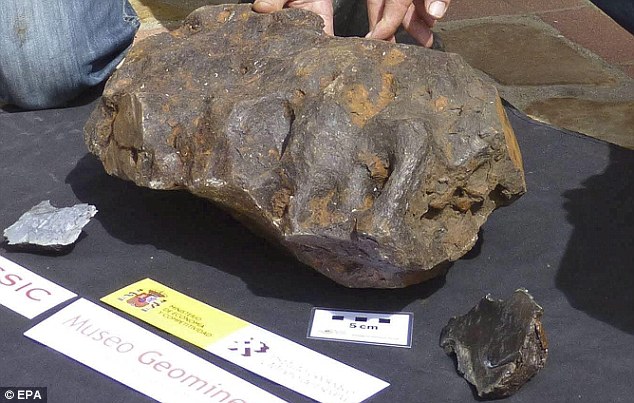
The image size is (634, 403). Identify the location of shadows on table. (593, 225), (240, 239).